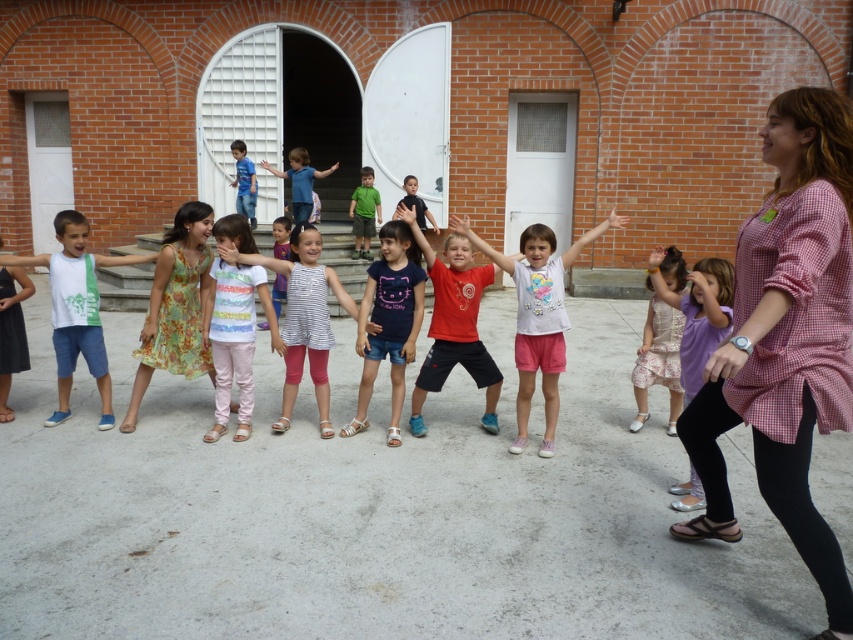
Can you confirm if floral dress at center is shorter than purple cotton dress at center?

Incorrect, floral dress at center's height does not fall short of purple cotton dress at center's.

Find the location of a particular element. The width and height of the screenshot is (853, 640). floral dress at center is located at coordinates (175, 307).

Who is more distant from viewer, (375, 275) or (726, 284)?

Point (375, 275)

Between dark blue jersey at center and purple cotton dress at center, which one appears on the left side from the viewer's perspective?

From the viewer's perspective, dark blue jersey at center appears more on the left side.

Find the location of `dark blue jersey at center`. dark blue jersey at center is located at coordinates 387,321.

Can you confirm if pink floral dress at center is positioned to the left of blue denim jeans at center?

In fact, pink floral dress at center is to the right of blue denim jeans at center.

Can you confirm if pink floral dress at center is positioned to the right of blue denim jeans at center?

Indeed, pink floral dress at center is positioned on the right side of blue denim jeans at center.

In order to click on pink floral dress at center in this screenshot , I will do `click(657, 360)`.